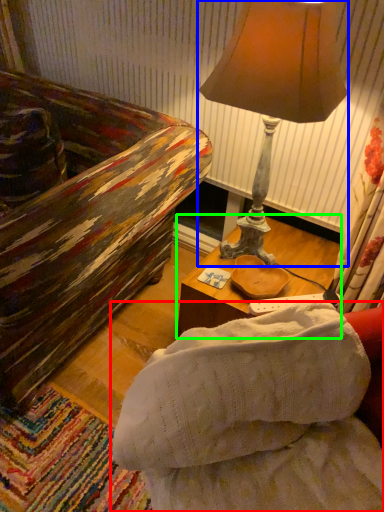
Question: Which object is positioned closest to studio couch (highlighted by a red box)? Select from lamp (highlighted by a blue box) and table (highlighted by a green box).

Choices:
 (A) lamp
 (B) table

Answer: (B)